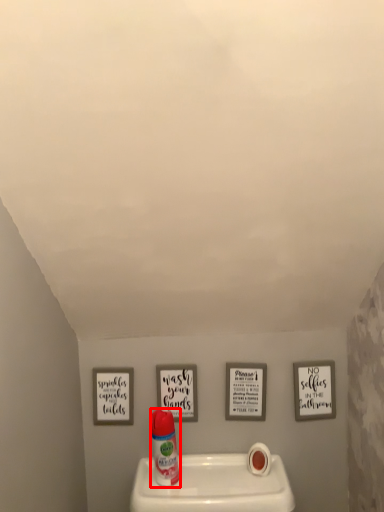
Question: From the image's perspective, where is cleaning product (annotated by the red box) located in relation to toilet paper in the image?

Choices:
 (A) below
 (B) above

Answer: (B)